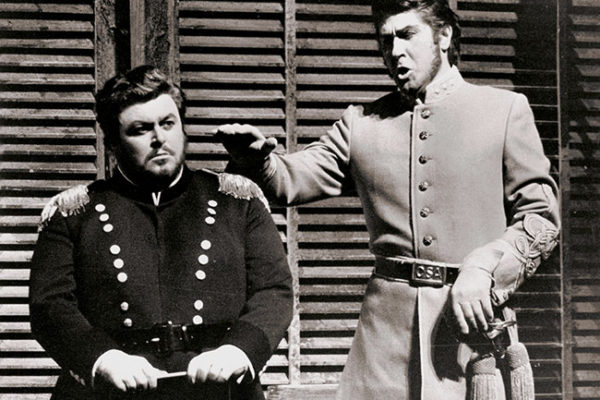
Point to any the window blinds in the middle of it all in the image. Your answer should be formatted as a list of tuples, i.e. [(x1, y1), (x2, y2), ...], where each tuple contains the x and y coordinates of a point satisfying the conditions above.

[(294, 216)]